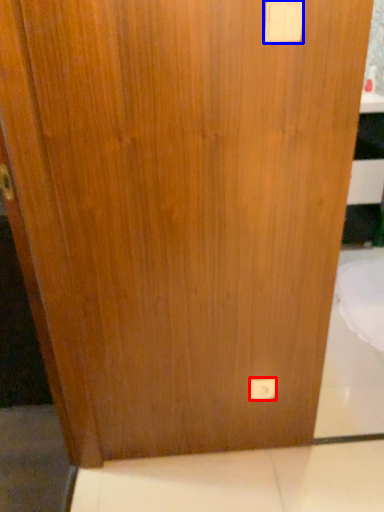
Question: Which of the following is the closest to the observer, light switch (highlighted by a red box) or light switch (highlighted by a blue box)?

Choices:
 (A) light switch
 (B) light switch

Answer: (B)